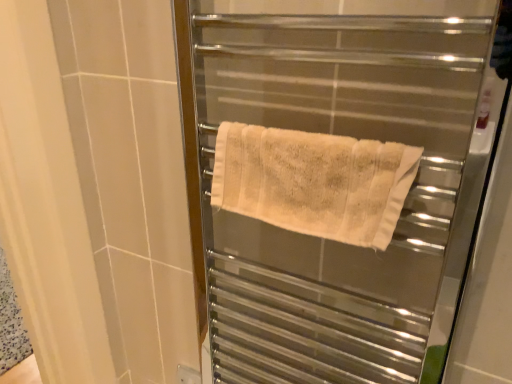
What is the approximate width of beige cotton towel at center?

It is 3.31 inches.

The image size is (512, 384). What do you see at coordinates (314, 182) in the screenshot?
I see `beige cotton towel at center` at bounding box center [314, 182].

This screenshot has width=512, height=384. I want to click on beige cotton towel at center, so click(314, 182).

What do you see at coordinates (334, 186) in the screenshot? This screenshot has height=384, width=512. I see `white textured towel at center` at bounding box center [334, 186].

Find the location of `white textured towel at center`. white textured towel at center is located at coordinates (334, 186).

Based on the photo, measure the distance between white textured towel at center and camera.

white textured towel at center and camera are 19.15 inches apart.

Locate an element on the screen. Image resolution: width=512 pixels, height=384 pixels. beige cotton towel at center is located at coordinates (314, 182).

Based on their positions, is white textured towel at center located to the left or right of beige cotton towel at center?

white textured towel at center is positioned on beige cotton towel at center's right side.

Who is more distant, white textured towel at center or beige cotton towel at center?

Positioned behind is beige cotton towel at center.

Considering the positions of point (210, 65) and point (327, 234), is point (210, 65) closer or farther from the camera than point (327, 234)?

Point (210, 65).

From the image's perspective, is white textured towel at center beneath beige cotton towel at center?

Yes, from the image's perspective, white textured towel at center is below beige cotton towel at center.

From a real-world perspective, who is located lower, white textured towel at center or beige cotton towel at center?

white textured towel at center is physically lower.

Which of these two, white textured towel at center or beige cotton towel at center, is wider?

white textured towel at center.

Does white textured towel at center have a greater height compared to beige cotton towel at center?

Indeed, white textured towel at center has a greater height compared to beige cotton towel at center.

Which of these two, white textured towel at center or beige cotton towel at center, is smaller?

beige cotton towel at center is smaller.

Would you say beige cotton towel at center is part of white textured towel at center's contents?

Yes, beige cotton towel at center can be found within white textured towel at center.

Is white textured towel at center beside beige cotton towel at center?

Yes, white textured towel at center is right next to beige cotton towel at center and making contact.

Could you tell me if white textured towel at center is facing beige cotton towel at center?

Yes, white textured towel at center is turned towards beige cotton towel at center.

What's the angular difference between white textured towel at center and beige cotton towel at center's facing directions?

There is a 0.00284-degree angle between the facing directions of white textured towel at center and beige cotton towel at center.

At what (x,y) coordinates should I click in order to perform the action: click on towel on the left of white textured towel at center. Please return your answer as a coordinate pair (x, y). This screenshot has width=512, height=384. Looking at the image, I should click on (314, 182).

Can you confirm if beige cotton towel at center is positioned to the right of white textured towel at center?

No, beige cotton towel at center is not to the right of white textured towel at center.

Is the depth of beige cotton towel at center greater than that of white textured towel at center?

Yes, the depth of beige cotton towel at center is greater than that of white textured towel at center.

Between point (326, 214) and point (394, 268), which one is positioned in front?

The point (326, 214) is more forward.

From the image's perspective, would you say beige cotton towel at center is shown under white textured towel at center?

No, from the image's perspective, beige cotton towel at center is not below white textured towel at center.

From a real-world perspective, is beige cotton towel at center positioned above or below white textured towel at center?

In terms of real-world spatial position, beige cotton towel at center is above white textured towel at center.

Consider the image. Which of these two, beige cotton towel at center or white textured towel at center, is thinner?

With smaller width is beige cotton towel at center.

Can you confirm if beige cotton towel at center is taller than white textured towel at center?

No.

Based on their sizes in the image, would you say beige cotton towel at center is bigger or smaller than white textured towel at center?

beige cotton towel at center is smaller than white textured towel at center.

Which is correct: beige cotton towel at center is inside white textured towel at center, or outside of it?

beige cotton towel at center is inside white textured towel at center.

Are beige cotton towel at center and white textured towel at center located far from each other?

Actually, beige cotton towel at center and white textured towel at center are a little close together.

Is beige cotton towel at center positioned with its back to white textured towel at center?

That's right, beige cotton towel at center is facing away from white textured towel at center.

The image size is (512, 384). In the image, there is a beige cotton towel at center. Identify the location of screen door below it (from a real-world perspective). (334, 186).

This screenshot has width=512, height=384. Find the location of `screen door that appears on the right of beige cotton towel at center`. screen door that appears on the right of beige cotton towel at center is located at coordinates (334, 186).

Identify the location of screen door below the beige cotton towel at center (from the image's perspective). (334, 186).